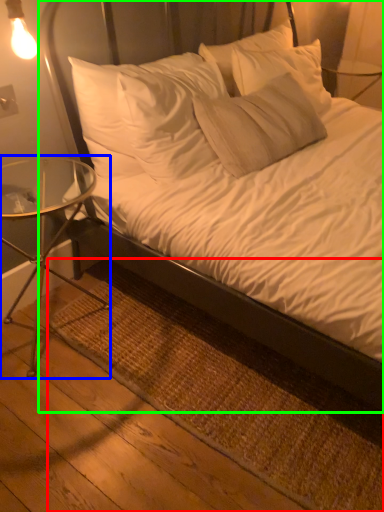
Question: Which object is positioned closest to mat (highlighted by a red box)? Select from table (highlighted by a blue box) and bed (highlighted by a green box).

Choices:
 (A) table
 (B) bed

Answer: (B)